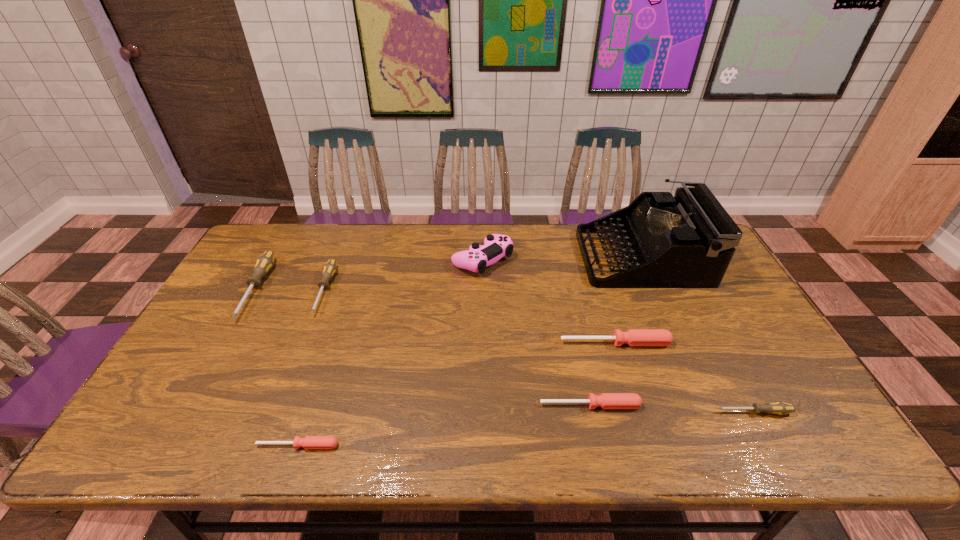
This screenshot has width=960, height=540. I want to click on vacant space located 0.170m on the back of the fourth nearest object, so click(601, 295).

Identify the location of blank space located 0.100m on the back of the second nearest red screwdriver. (582, 366).

Where is `vacant space located 0.090m at the tip of the nearest gray screwdriver`? The image size is (960, 540). vacant space located 0.090m at the tip of the nearest gray screwdriver is located at coordinates (677, 412).

The image size is (960, 540). I want to click on free location located 0.200m at the tip of the nearest gray screwdriver, so click(x=631, y=412).

The image size is (960, 540). In order to click on vacant point located 0.290m at the tip of the nearest gray screwdriver in this screenshot , I will do `click(592, 412)`.

Identify the location of vacant region located on the right of the nearest screwdriver. The width and height of the screenshot is (960, 540). (383, 446).

Find the location of a particular element. typewriter that is positioned at the far edge is located at coordinates (687, 241).

Locate an element on the screen. Image resolution: width=960 pixels, height=540 pixels. control situated at the far edge is located at coordinates (476, 259).

Identify the location of screwdriver that is at the far edge. (264, 263).

The image size is (960, 540). What are the coordinates of `object present at the left edge` in the screenshot? It's located at (264, 263).